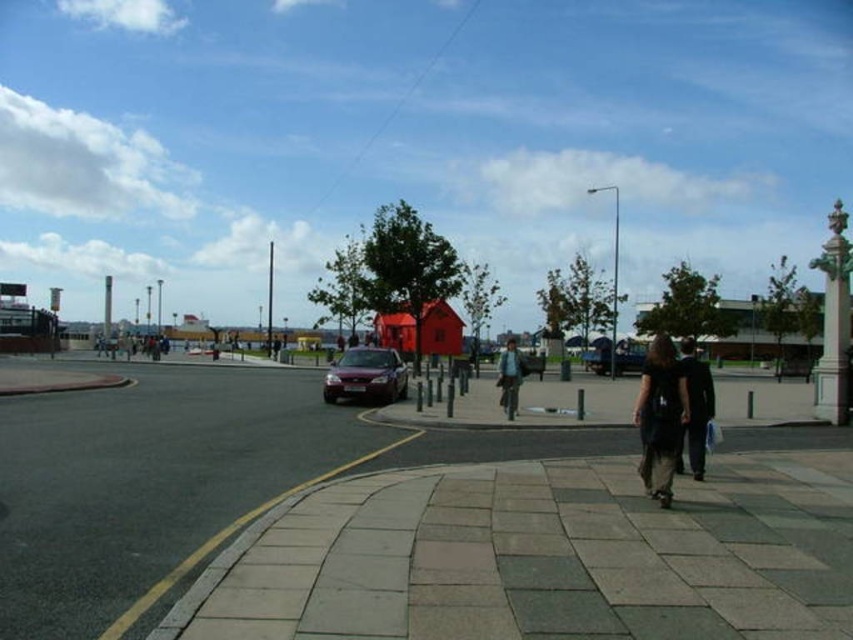
You are a pedestrian standing on the sidewalk and see both the light brown leather jacket at center and the dark blue jacket at center. Which jacket is closer to you?

The light brown leather jacket at center is closer to you because it is positioned under the dark blue jacket at center, meaning it is in front of the dark blue jacket.

You are a pedestrian standing on the sidewalk and see the dark gray fabric jacket at lower right and the maroon metallic car at center. Which object is closer to the right edge of the sidewalk?

The dark gray fabric jacket at lower right is closer to the right edge of the sidewalk because it is positioned to the right of the maroon metallic car at center.

You are a delivery person trying to park your delivery van, which is 2 meters wide, in the parking spot near the maroon metallic car at center and the dark gray suit at lower right. Based on the scene, can your van fit in the parking spot if the space between them is determined by their widths?

The maroon metallic car at center has a lesser width compared to dark gray suit at lower right. However, the width of the dark gray suit at lower right is not provided, so it is impossible to determine if the 2 meter wide van can fit in the parking spot between them.